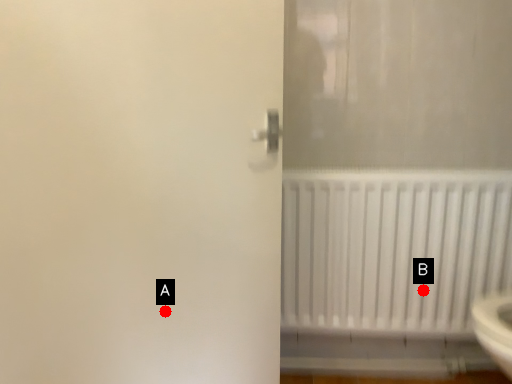
Question: Two points are circled on the image, labeled by A and B beside each circle. Which point is further to the camera?

Choices:
 (A) A is further
 (B) B is further

Answer: (B)